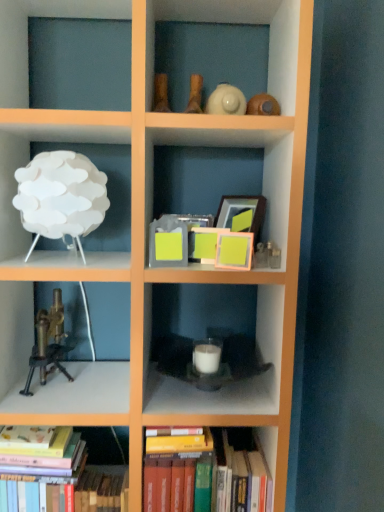
Looking at this image, measure the distance between hardcover books at center, the second book viewed from the left, and camera.

hardcover books at center, the second book viewed from the left, and camera are 1.26 meters apart.

Find the location of a particular element. The image size is (384, 512). white matte candle at center, marked as the 2th shelf in a top-to-bottom arrangement is located at coordinates (207, 334).

Is brass/bronze microscope at left aimed at white matte candle at center, marked as the 2th shelf in a top-to-bottom arrangement?

No, brass/bronze microscope at left is not oriented towards white matte candle at center, marked as the 2th shelf in a top-to-bottom arrangement.

From the image's perspective, does brass/bronze microscope at left appear higher than white matte candle at center, marked as the 2th shelf in a top-to-bottom arrangement?

Yes.

The image size is (384, 512). I want to click on shelf that is the 2nd object to the right of the brass/bronze microscope at left, starting at the anchor, so click(207, 334).

Is hardcover books at lower left, positioned as the first book in left-to-right order, inside or outside of white matte candle at center, the first shelf ordered from the bottom?

hardcover books at lower left, positioned as the first book in left-to-right order, is not inside white matte candle at center, the first shelf ordered from the bottom, it's outside.

In terms of height, does hardcover books at lower left, acting as the 2th book starting from the right, look taller or shorter compared to white matte candle at center, the second shelf when ordered from left to right?

In the image, hardcover books at lower left, acting as the 2th book starting from the right, appears to be taller than white matte candle at center, the second shelf when ordered from left to right.

Can you tell me how much hardcover books at lower left, acting as the 2th book starting from the right, and white matte candle at center, the first shelf ordered from the bottom, differ in facing direction?

3.2 degrees.

I want to click on the 2nd shelf counting from the right of the hardcover books at lower left, acting as the 2th book starting from the right, so click(207, 334).

Which book is the 1st one when counting from the front of the brass/bronze microscope at left? Please provide its 2D coordinates.

[(204, 475)]

Would you say brass/bronze microscope at left is a long distance from hardcover books at center, positioned as the 1th book in right-to-left order?

No, brass/bronze microscope at left is in close proximity to hardcover books at center, positioned as the 1th book in right-to-left order.

From a real-world perspective, does brass/bronze microscope at left sit lower than hardcover books at center, positioned as the 1th book in right-to-left order?

Actually, brass/bronze microscope at left is physically above hardcover books at center, positioned as the 1th book in right-to-left order, in the real world.

Based on their sizes in the image, would you say white matte lamp at upper left, which is the 2th shelf in right-to-left order, is bigger or smaller than hardcover books at lower left, positioned as the first book in left-to-right order?

Considering their sizes, white matte lamp at upper left, which is the 2th shelf in right-to-left order, takes up less space than hardcover books at lower left, positioned as the first book in left-to-right order.

Is white matte lamp at upper left, placed as the second shelf when sorted from bottom to top, touching hardcover books at lower left, acting as the 2th book starting from the right?

They are not placed beside each other.

This screenshot has height=512, width=384. Find the location of `shelf that is the 1st one when counting rightward from the hardcover books at lower left, acting as the 2th book starting from the right`. shelf that is the 1st one when counting rightward from the hardcover books at lower left, acting as the 2th book starting from the right is located at coordinates (28, 159).

Which is farther, (0, 125) or (53, 483)?

The point (53, 483) is farther from the camera.

Where is `book that is the 1st object directly below the brass/bronze microscope at left (from a real-world perspective)`? The image size is (384, 512). book that is the 1st object directly below the brass/bronze microscope at left (from a real-world perspective) is located at coordinates (204, 475).

From the image's perspective, would you say hardcover books at center, positioned as the 1th book in right-to-left order, is positioned over brass/bronze microscope at left?

No, from the image's perspective, hardcover books at center, positioned as the 1th book in right-to-left order, is not on top of brass/bronze microscope at left.

From their relative heights in the image, would you say hardcover books at center, the second book viewed from the left, is taller or shorter than brass/bronze microscope at left?

Clearly, hardcover books at center, the second book viewed from the left, is taller compared to brass/bronze microscope at left.

Between white matte candle at center, the second shelf when ordered from left to right, and brass/bronze microscope at left, which one has smaller width?

With smaller width is brass/bronze microscope at left.

Which is closer to the camera, (254, 285) or (39, 349)?

The point (39, 349) is in front.

Is white matte candle at center, the second shelf when ordered from left to right, touching brass/bronze microscope at left?

white matte candle at center, the second shelf when ordered from left to right, and brass/bronze microscope at left are not in contact.

Is hardcover books at lower left, positioned as the first book in left-to-right order, turned away from hardcover books at center, positioned as the 1th book in right-to-left order?

That's not correct — hardcover books at lower left, positioned as the first book in left-to-right order, is not looking away from hardcover books at center, positioned as the 1th book in right-to-left order.

Which is more to the right, hardcover books at lower left, positioned as the first book in left-to-right order, or hardcover books at center, positioned as the 1th book in right-to-left order?

From the viewer's perspective, hardcover books at center, positioned as the 1th book in right-to-left order, appears more on the right side.

Is hardcover books at lower left, positioned as the first book in left-to-right order, in front of or behind hardcover books at center, positioned as the 1th book in right-to-left order, in the image?

Visually, hardcover books at lower left, positioned as the first book in left-to-right order, is located in front of hardcover books at center, positioned as the 1th book in right-to-left order.

Could you measure the distance between hardcover books at lower left, positioned as the first book in left-to-right order, and hardcover books at center, positioned as the 1th book in right-to-left order?

hardcover books at lower left, positioned as the first book in left-to-right order, and hardcover books at center, positioned as the 1th book in right-to-left order, are 9.47 inches apart.

Where is `toy that is on the left side of white matte candle at center, marked as the 2th shelf in a top-to-bottom arrangement`? Image resolution: width=384 pixels, height=512 pixels. toy that is on the left side of white matte candle at center, marked as the 2th shelf in a top-to-bottom arrangement is located at coordinates (48, 344).

The image size is (384, 512). Identify the location of the 1st shelf above when counting from the hardcover books at lower left, positioned as the first book in left-to-right order (from the image's perspective). (207, 334).

Which object lies further to the anchor point hardcover books at center, positioned as the 1th book in right-to-left order, white matte lamp at upper left, placed as the second shelf when sorted from bottom to top, or white matte candle at center, marked as the 1th shelf in a right-to-left arrangement?

white matte lamp at upper left, placed as the second shelf when sorted from bottom to top.

When comparing their distances from white matte lamp at upper left, placed as the second shelf when sorted from bottom to top, does brass/bronze microscope at left or hardcover books at lower left, positioned as the first book in left-to-right order, seem closer?

Among the two, brass/bronze microscope at left is located nearer to white matte lamp at upper left, placed as the second shelf when sorted from bottom to top.

Looking at the image, which one is located closer to brass/bronze microscope at left, white matte candle at center, marked as the 2th shelf in a top-to-bottom arrangement, or hardcover books at lower left, acting as the 2th book starting from the right?

hardcover books at lower left, acting as the 2th book starting from the right, is closer to brass/bronze microscope at left.

Estimate the real-world distances between objects in this image. Which object is closer to brass/bronze microscope at left, hardcover books at center, the second book viewed from the left, or hardcover books at lower left, acting as the 2th book starting from the right?

Among the two, hardcover books at lower left, acting as the 2th book starting from the right, is located nearer to brass/bronze microscope at left.

Considering their positions, is hardcover books at lower left, acting as the 2th book starting from the right, positioned closer to white matte lamp at upper left, which is the 2th shelf in right-to-left order, than hardcover books at center, positioned as the 1th book in right-to-left order?

hardcover books at lower left, acting as the 2th book starting from the right.

Considering their positions, is hardcover books at center, the second book viewed from the left, positioned closer to brass/bronze microscope at left than white matte lamp at upper left, arranged as the first shelf when viewed from the top?

white matte lamp at upper left, arranged as the first shelf when viewed from the top.

Consider the image. Based on their spatial positions, is hardcover books at center, the second book viewed from the left, or hardcover books at lower left, positioned as the first book in left-to-right order, further from white matte lamp at upper left, placed as the second shelf when sorted from bottom to top?

hardcover books at center, the second book viewed from the left, is further to white matte lamp at upper left, placed as the second shelf when sorted from bottom to top.

Based on their spatial positions, is white matte candle at center, the second shelf when ordered from left to right, or hardcover books at lower left, acting as the 2th book starting from the right, closer to white matte lamp at upper left, which is the 2th shelf in right-to-left order?

Based on the image, white matte candle at center, the second shelf when ordered from left to right, appears to be nearer to white matte lamp at upper left, which is the 2th shelf in right-to-left order.

Locate an element on the screen. The height and width of the screenshot is (512, 384). shelf between white matte lamp at upper left, placed as the second shelf when sorted from bottom to top, and hardcover books at lower left, positioned as the first book in left-to-right order, from top to bottom is located at coordinates (207, 334).

Where is `toy between white matte lamp at upper left, which ranks as the 1th shelf in left-to-right order, and hardcover books at center, the second book viewed from the left, in the vertical direction`? This screenshot has width=384, height=512. toy between white matte lamp at upper left, which ranks as the 1th shelf in left-to-right order, and hardcover books at center, the second book viewed from the left, in the vertical direction is located at coordinates (48, 344).

Find the location of a particular element. book situated between hardcover books at lower left, positioned as the first book in left-to-right order, and white matte candle at center, the first shelf ordered from the bottom, from left to right is located at coordinates (204, 475).

Where is `book located between brass/bronze microscope at left and hardcover books at center, the second book viewed from the left, in the left-right direction`? This screenshot has width=384, height=512. book located between brass/bronze microscope at left and hardcover books at center, the second book viewed from the left, in the left-right direction is located at coordinates (63, 484).